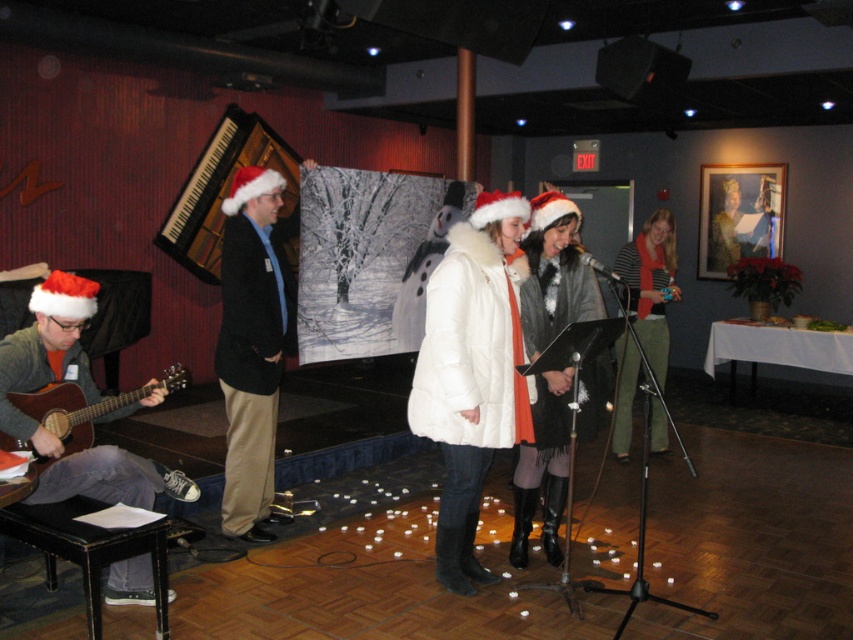
Is matte gray sweater at lower left above orange scarf at center?

Actually, matte gray sweater at lower left is below orange scarf at center.

Between matte gray sweater at lower left and orange scarf at center, which one has less height?

matte gray sweater at lower left is shorter.

Between point (48, 374) and point (631, 371), which one is positioned behind?

The point (631, 371) is behind.

The width and height of the screenshot is (853, 640). Identify the location of matte gray sweater at lower left. (84, 397).

Who is positioned more to the right, black woolen jacket at center or orange scarf at center?

Positioned to the right is orange scarf at center.

Does black woolen jacket at center have a greater height compared to orange scarf at center?

Yes, black woolen jacket at center is taller than orange scarf at center.

Describe the element at coordinates (251, 346) in the screenshot. The width and height of the screenshot is (853, 640). I see `black woolen jacket at center` at that location.

Locate an element on the screen. The height and width of the screenshot is (640, 853). black woolen jacket at center is located at coordinates (251, 346).

Is black woolen jacket at center smaller than black matte microphone at center?

Incorrect, black woolen jacket at center is not smaller in size than black matte microphone at center.

Does black woolen jacket at center have a larger size compared to black matte microphone at center?

Indeed, black woolen jacket at center has a larger size compared to black matte microphone at center.

Identify the location of black woolen jacket at center. pos(251,346).

Find the location of `black woolen jacket at center`. black woolen jacket at center is located at coordinates (251, 346).